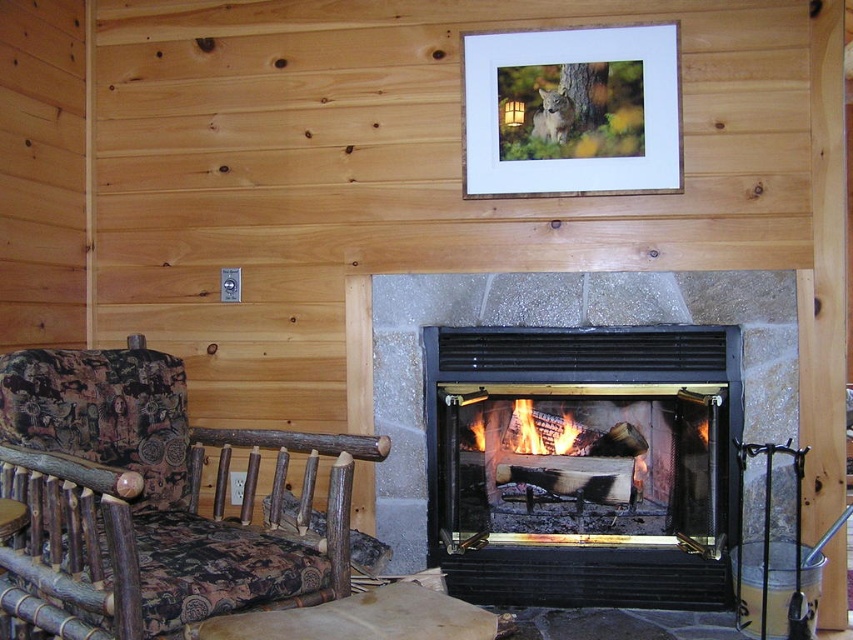
You are standing in the cabin and want to hang a small picture frame between the two points, point (209, 552) and point (573, 116). Which point should the frame be closer to so it is nearer to your eye level?

The frame should be placed closer to point (209, 552) because it is closer to the viewer than point (573, 116).

You are an interior designer planning to hang a new picture on the wall. You notice the wooden frame at upper center and the charcoal wood fire at center. Which object has a greater width?

The wooden frame at upper center has a greater width than the charcoal wood fire at center.